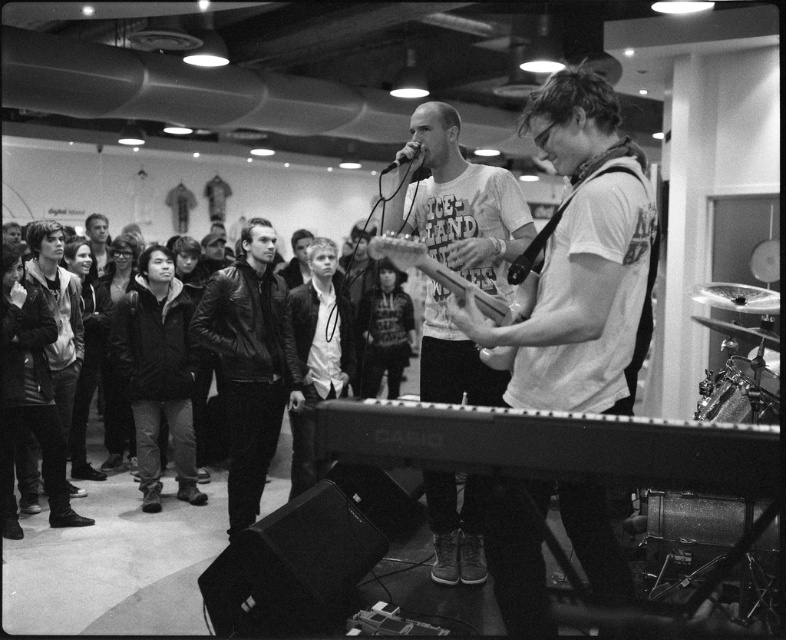
Question: Which object appears closest to the camera in this image?

Choices:
 (A) metallic silver keyboard at lower center
 (B) leather jacket at center

Answer: (A)

Question: Which point is closer to the camera?

Choices:
 (A) (399, 161)
 (B) (428, 141)

Answer: (A)

Question: Is metallic silver guitar at center above metallic silver microphone at upper center?

Choices:
 (A) yes
 (B) no

Answer: (B)

Question: From the image, what is the correct spatial relationship of leather jacket at center in relation to metallic silver guitar at center?

Choices:
 (A) right
 (B) left

Answer: (B)

Question: Does matte white t-shirt at center have a smaller size compared to metallic silver microphone at upper center?

Choices:
 (A) no
 (B) yes

Answer: (A)

Question: Which of these objects is positioned closest to the white matte guitar at center?

Choices:
 (A) metallic silver keyboard at lower center
 (B) metallic silver guitar at center

Answer: (B)